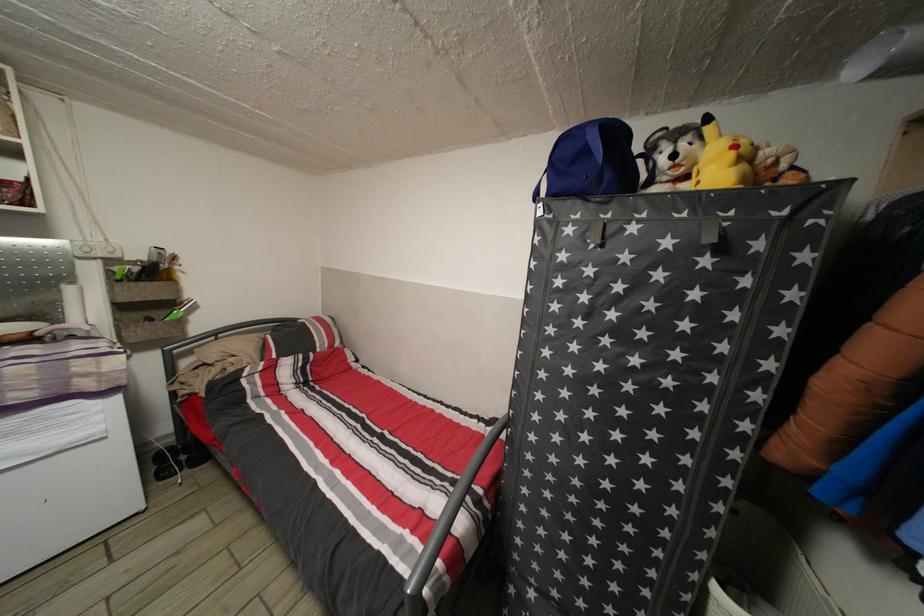
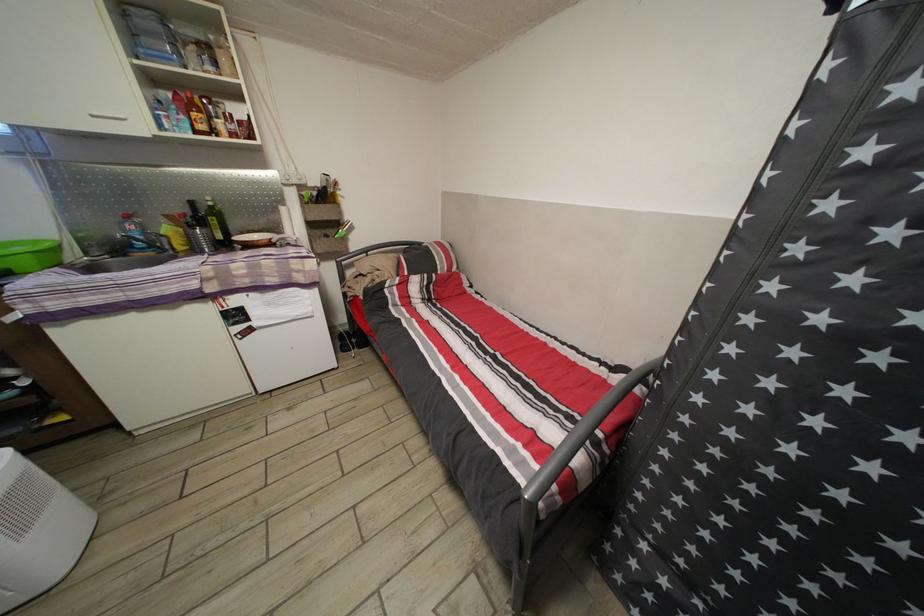
In a continuous first-person perspective shot, in which direction is the camera moving?

The cameraman moved toward left, forward.